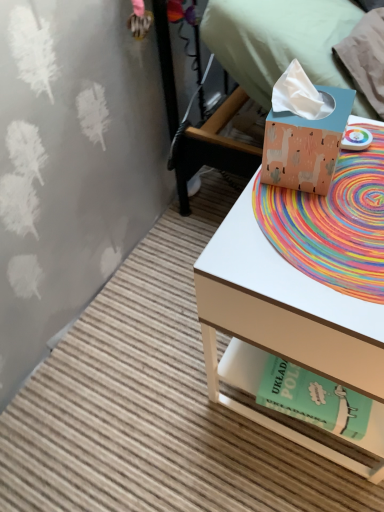
The height and width of the screenshot is (512, 384). I want to click on vacant space situated above rainbow woven mat at center (from a real-world perspective), so click(334, 198).